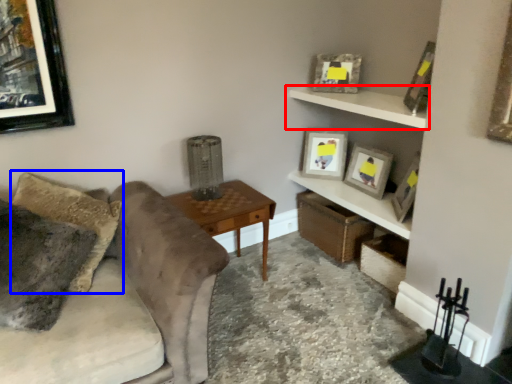
Question: Which point is closer to the camera, shelf (highlighted by a red box) or pillow (highlighted by a blue box)?

Choices:
 (A) shelf
 (B) pillow

Answer: (B)